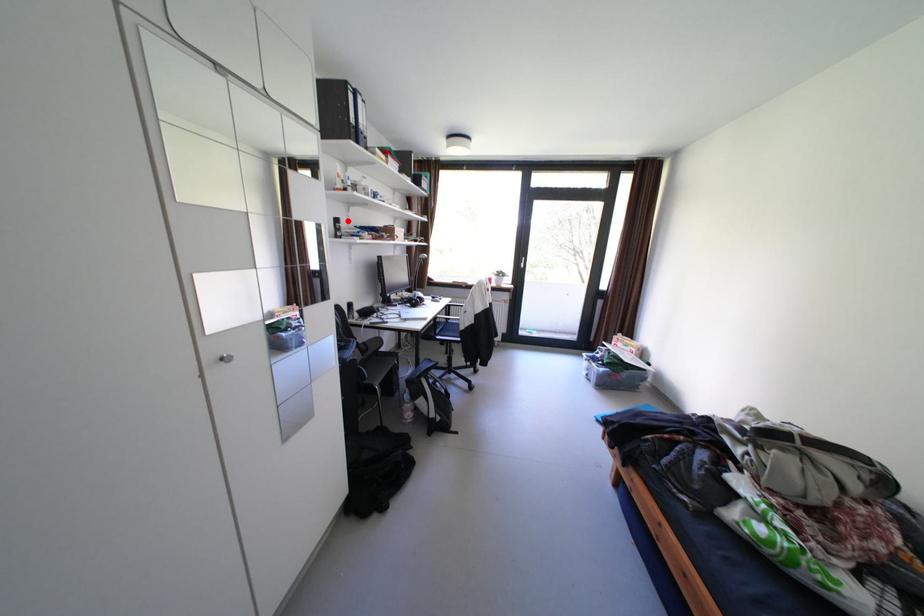
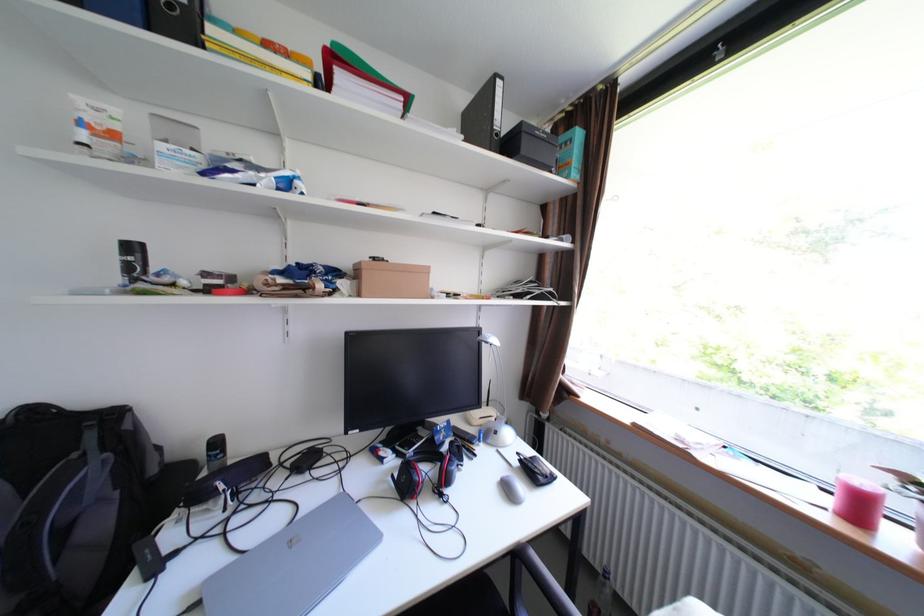
The point at the highlighted location is marked in the first image. Where is the corresponding point in the second image?

(143, 248)